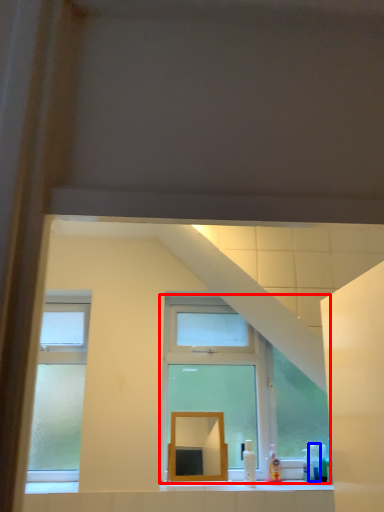
Question: Which object is further to the camera taking this photo, window (highlighted by a red box) or toiletry (highlighted by a blue box)?

Choices:
 (A) window
 (B) toiletry

Answer: (B)